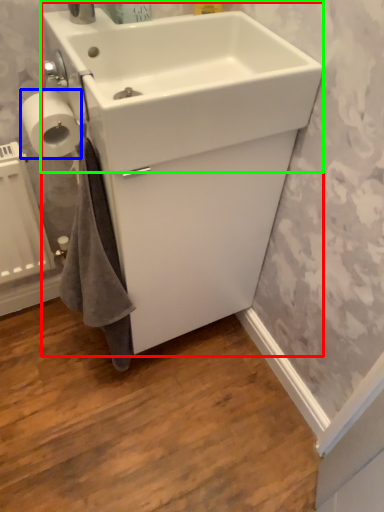
Question: Which object is positioned closest to sink (highlighted by a red box)? Select from toilet paper (highlighted by a blue box) and sink (highlighted by a green box).

Choices:
 (A) toilet paper
 (B) sink

Answer: (B)